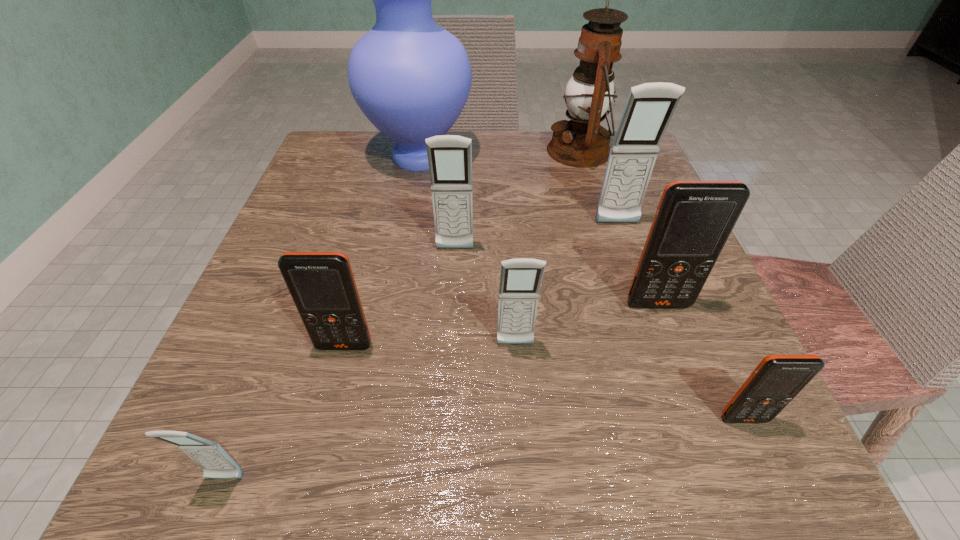
This screenshot has height=540, width=960. What are the coordinates of `free space between the fourth farthest object and the smallest orange cellular telephone` in the screenshot? It's located at (599, 334).

Locate an element on the screen. free space between the lantern and the leftmost orange cellular telephone is located at coordinates (462, 248).

You are a GUI agent. You are given a task and a screenshot of the screen. Output one action in this format:
    pyautogui.click(x=<x>, y=<y>)
    Task: Click on the vacant area between the second nearest gray cellular telephone and the brown lantern
    The height and width of the screenshot is (540, 960).
    Given the screenshot: What is the action you would take?
    pyautogui.click(x=547, y=248)

Find the location of a particular element. free area in between the farthest cellular telephone and the second nearest object is located at coordinates (681, 321).

You are a GUI agent. You are given a task and a screenshot of the screen. Output one action in this format:
    pyautogui.click(x=<x>, y=<y>)
    Task: Click on the unoccupied area between the nearest cellular telephone and the fifth nearest object
    Image resolution: width=960 pixels, height=540 pixels.
    Given the screenshot: What is the action you would take?
    pyautogui.click(x=442, y=392)

Locate an element on the screen. The height and width of the screenshot is (540, 960). free space between the nearest orange cellular telephone and the second farthest gray cellular telephone is located at coordinates (599, 334).

The image size is (960, 540). In order to click on free spot between the fourth cellular telephone from right to left and the vase in this screenshot , I will do coord(468,251).

At what (x,y) coordinates should I click in order to perform the action: click on free space that is in between the third cellular telephone from left to right and the biggest orange cellular telephone. Please return your answer as a coordinate pair (x, y). Looking at the image, I should click on (557, 276).

This screenshot has width=960, height=540. Find the location of `free area in between the sixth nearest cellular telephone and the sixth farthest cellular telephone`. free area in between the sixth nearest cellular telephone and the sixth farthest cellular telephone is located at coordinates (599, 334).

Find the location of a particular element. This screenshot has width=960, height=540. the second closest object to the second nearest cellular telephone is located at coordinates (520, 279).